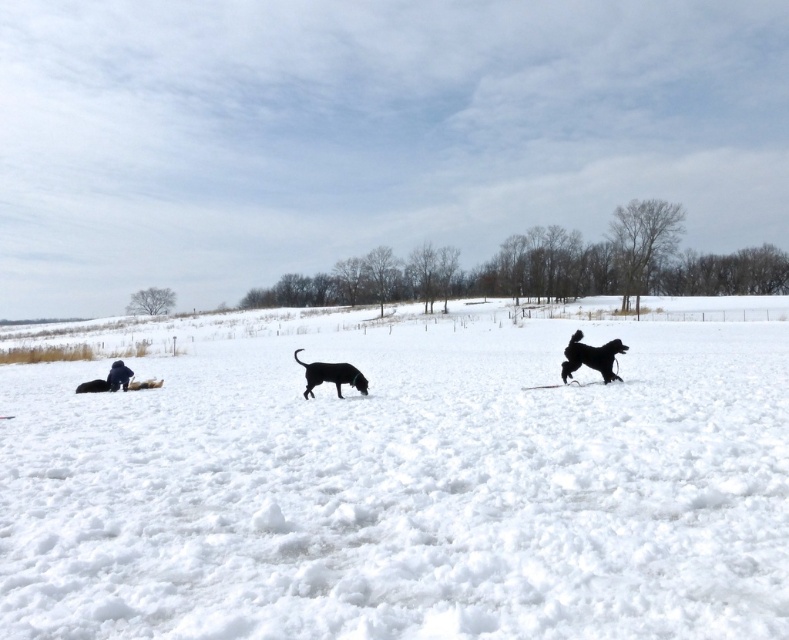
You are standing at the origin point in the winter scene. There is a white fluffy snow at center marked by point [404,481]. If you walk straight from your current position towards the point, will you encounter any obstacles before reaching the snow?

The white fluffy snow at center is located at point [404,481]. Since the scene describes an open field covered in snow with sparsely distributed trees and two dogs playing nearby, there are no significant obstacles blocking the path from the origin to the snow at center. The path should be clear except for possible loose snow, which is part of the ground surface and not an obstruction.

From the picture: You are a photographer trying to capture the black matte dog at center in the winter scene. Since the white fluffy snow at center is blocking the view, can you move the snow to get a clear shot of the dog?

The white fluffy snow at center is in front of the black matte dog at center, so moving the snow would allow you to see the dog clearly.

You are a photographer wanting to capture both the black fur dog at right and the black matte dog at center in a single frame. Given that your camera can only focus on objects within a 1.5 meter height range, will both dogs fit within this range?

The black fur dog at right is taller than the black matte dog at center. Since the height difference between them is not specified, it is uncertain if their combined height range falls within the camera focus limit of 1.5 meters. Further information about their exact heights is needed to determine this.